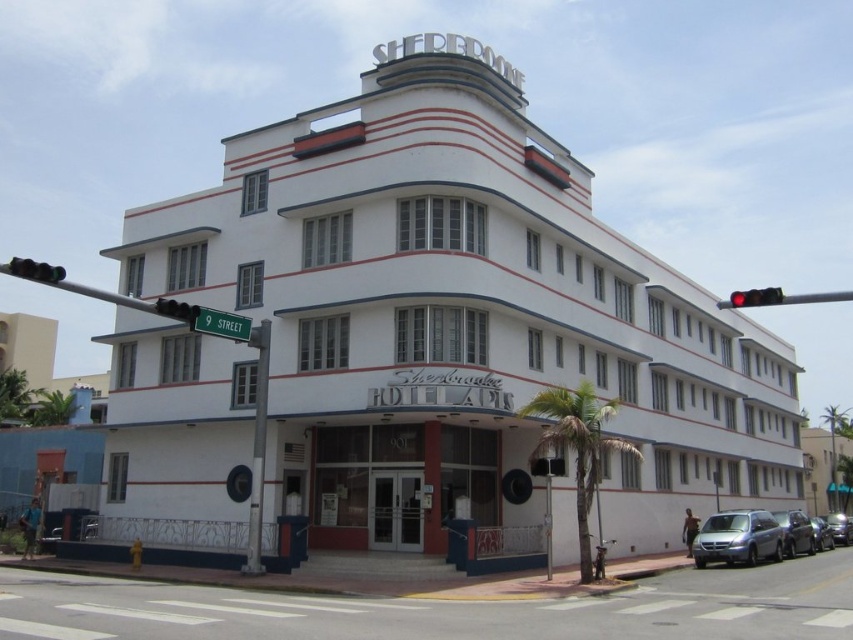
Question: Considering the real-world distances, which object is closest to the white smooth building at center?

Choices:
 (A) metallic gray van at lower right
 (B) red glass traffic light at upper left

Answer: (A)

Question: Does green metallic street sign at upper center have a larger size compared to green glass traffic light at upper left?

Choices:
 (A) no
 (B) yes

Answer: (A)

Question: Can you confirm if metallic gray van at lower right is wider than red glass traffic light at upper left?

Choices:
 (A) no
 (B) yes

Answer: (B)

Question: Which of the following is the farthest from the observer?

Choices:
 (A) white smooth building at center
 (B) green glass traffic light at upper left

Answer: (A)

Question: Can you confirm if green glass traffic light at upper left is wider than red glass traffic light at upper right?

Choices:
 (A) no
 (B) yes

Answer: (B)

Question: Estimate the real-world distances between objects in this image. Which object is closer to the red glass traffic light at upper left?

Choices:
 (A) green metallic street sign at upper center
 (B) red glass traffic light at upper right

Answer: (A)